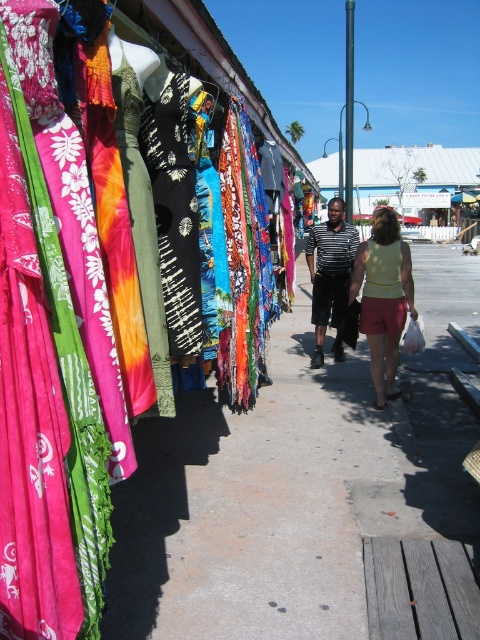
Question: Does matte fabric dress at upper left appear under yellow cotton tank top at center?

Choices:
 (A) no
 (B) yes

Answer: (A)

Question: Which point appears closest to the camera in this image?

Choices:
 (A) (123, 324)
 (B) (338, 632)
 (C) (331, 227)

Answer: (A)

Question: Does smooth concrete sidewalk at center appear over striped cotton shirt at center?

Choices:
 (A) no
 (B) yes

Answer: (A)

Question: Which object appears farthest from the camera in this image?

Choices:
 (A) smooth concrete sidewalk at center
 (B) light yellow fabric shorts at center
 (C) striped cotton shirt at center

Answer: (C)

Question: Observing the image, what is the correct spatial positioning of matte fabric dress at upper left in reference to smooth concrete sidewalk at center?

Choices:
 (A) above
 (B) below

Answer: (A)

Question: Which point is farther to the camera?

Choices:
 (A) (352, 241)
 (B) (372, 227)
 (C) (381, 522)

Answer: (B)